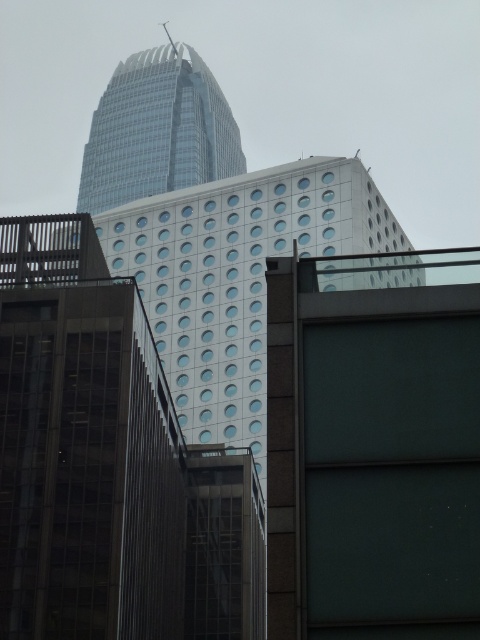
Which is behind, point (142, 524) or point (132, 115)?

The point (132, 115) is more distant.

Can you confirm if glassy reflective building at center is shorter than transparent glass skyscraper at upper center?

Yes.

What are the coordinates of `glassy reflective building at center` in the screenshot? It's located at (84, 445).

Which is above, dark glass building at upper center or white textured building at center?

Positioned higher is white textured building at center.

Which of these two, dark glass building at upper center or white textured building at center, stands taller?

white textured building at center

Who is more distant from viewer, (294, 394) or (103, 227)?

The point (103, 227) is behind.

Find the location of a particular element. This screenshot has width=480, height=640. dark glass building at upper center is located at coordinates (373, 445).

Is dark glass building at upper center to the left of glassy reflective building at center from the viewer's perspective?

Incorrect, dark glass building at upper center is not on the left side of glassy reflective building at center.

Which is below, dark glass building at upper center or glassy reflective building at center?

glassy reflective building at center is lower down.

Find the location of `dark glass building at upper center`. dark glass building at upper center is located at coordinates (373, 445).